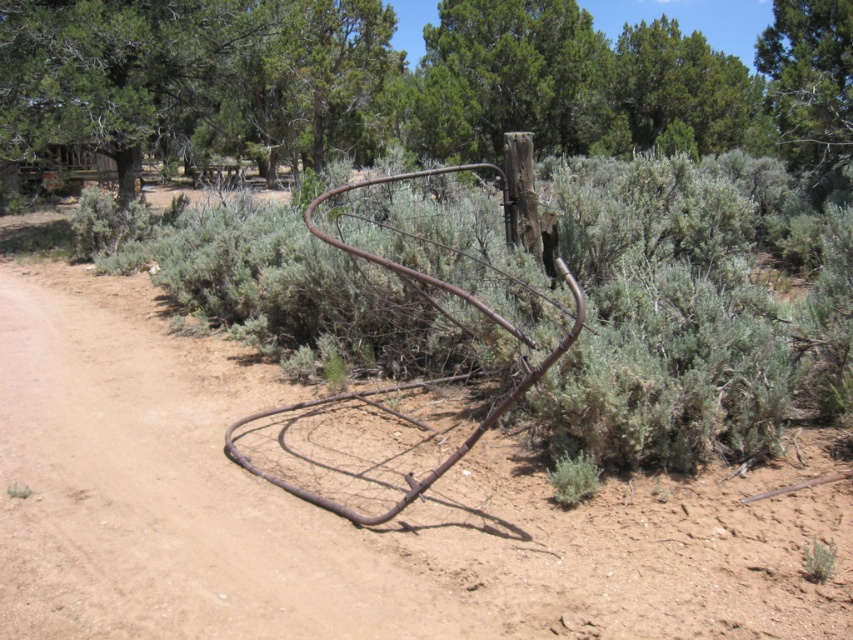
Question: Does brown dirt track at center come behind green leafy tree at upper center?

Choices:
 (A) yes
 (B) no

Answer: (B)

Question: Which object is closer to the camera taking this photo?

Choices:
 (A) green leafy tree at upper center
 (B) brown dirt track at center

Answer: (B)

Question: Is brown dirt track at center thinner than green leafy tree at upper center?

Choices:
 (A) no
 (B) yes

Answer: (A)

Question: Is brown dirt track at center wider than green leafy tree at upper center?

Choices:
 (A) yes
 (B) no

Answer: (A)